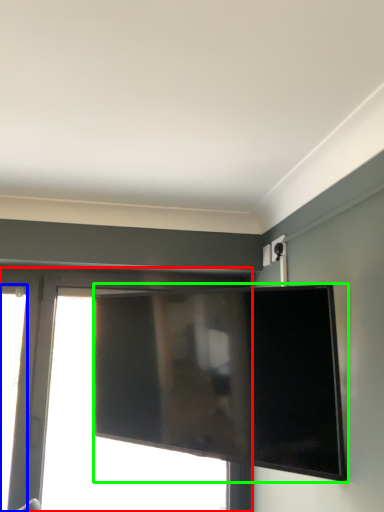
Question: Estimate the real-world distances between objects in this image. Which object is closer to window (highlighted by a red box), window (highlighted by a blue box) or television (highlighted by a green box)?

Choices:
 (A) window
 (B) television

Answer: (A)